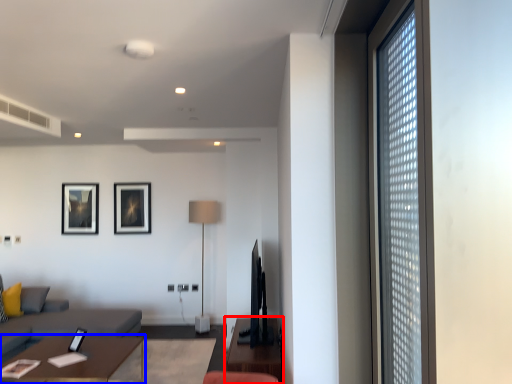
Question: Which of the following is the farthest to the observer, table (highlighted by a red box) or table (highlighted by a blue box)?

Choices:
 (A) table
 (B) table

Answer: (A)